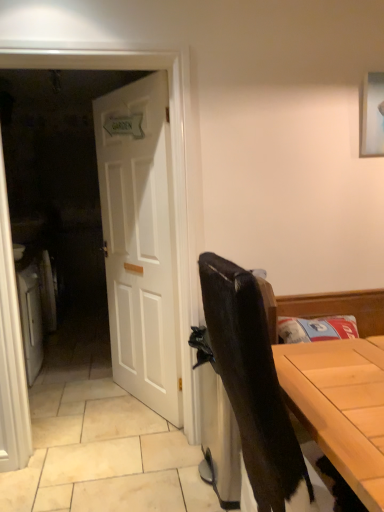
Question: From a real-world perspective, is white wooden door at left located higher than white wooden door at center?

Choices:
 (A) yes
 (B) no

Answer: (A)

Question: From the image's perspective, is white wooden door at left below white wooden door at center?

Choices:
 (A) no
 (B) yes

Answer: (B)

Question: Is white wooden door at left taller than white wooden door at center?

Choices:
 (A) no
 (B) yes

Answer: (B)

Question: Is white wooden door at center inside white wooden door at left?

Choices:
 (A) no
 (B) yes

Answer: (A)

Question: Is white wooden door at left thinner than white wooden door at center?

Choices:
 (A) no
 (B) yes

Answer: (A)

Question: Would you say white wooden door at left is inside or outside matte black chair at right?

Choices:
 (A) inside
 (B) outside

Answer: (B)

Question: Considering the positions of point (192, 297) and point (251, 313), is point (192, 297) closer or farther from the camera than point (251, 313)?

Choices:
 (A) farther
 (B) closer

Answer: (A)

Question: Based on their sizes in the image, would you say white wooden door at left is bigger or smaller than matte black chair at right?

Choices:
 (A) big
 (B) small

Answer: (B)

Question: From the image's perspective, is white wooden door at left above or below matte black chair at right?

Choices:
 (A) below
 (B) above

Answer: (B)

Question: In terms of width, does white wooden door at center look wider or thinner when compared to white wooden door at left?

Choices:
 (A) wide
 (B) thin

Answer: (B)

Question: Is point (150, 192) positioned closer to the camera than point (185, 240)?

Choices:
 (A) closer
 (B) farther

Answer: (B)

Question: From their relative heights in the image, would you say white wooden door at center is taller or shorter than white wooden door at left?

Choices:
 (A) short
 (B) tall

Answer: (A)

Question: In the image, is white wooden door at center positioned in front of or behind white wooden door at left?

Choices:
 (A) behind
 (B) front

Answer: (A)

Question: Is matte black chair at right wider or thinner than white wooden door at left?

Choices:
 (A) thin
 (B) wide

Answer: (B)

Question: Is matte black chair at right inside or outside of white wooden door at left?

Choices:
 (A) outside
 (B) inside

Answer: (A)